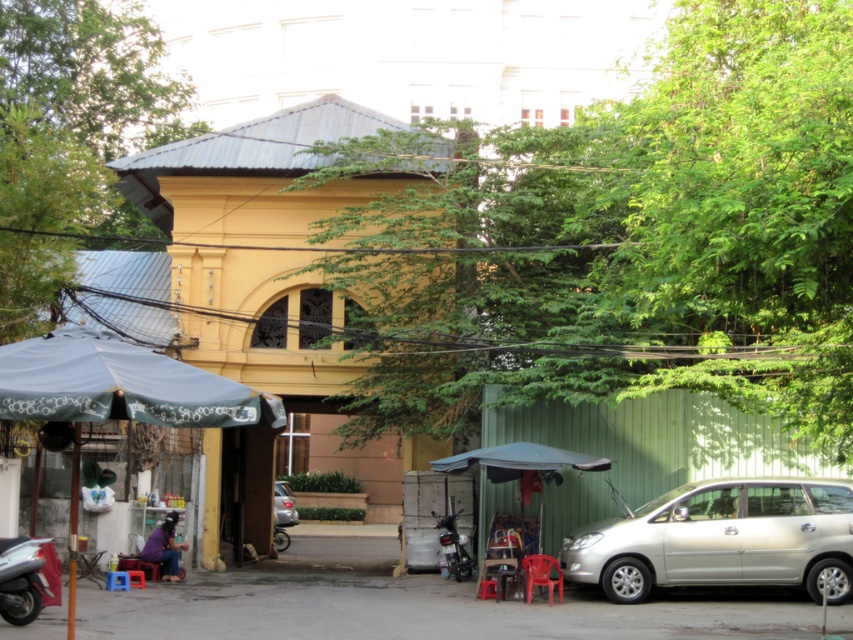
Does silver metallic car at lower right have a lesser height compared to shiny black motorcycle at center?

Incorrect, silver metallic car at lower right's height does not fall short of shiny black motorcycle at center's.

Which is below, silver metallic car at lower right or shiny black motorcycle at center?

shiny black motorcycle at center is below.

Between point (793, 509) and point (457, 544), which one is positioned in front?

Point (793, 509) is more forward.

The image size is (853, 640). Find the location of `silver metallic car at lower right`. silver metallic car at lower right is located at coordinates (722, 538).

Does blue fabric umbrella at lower left have a greater width compared to metallic silver motorcycle at lower left?

Indeed, blue fabric umbrella at lower left has a greater width compared to metallic silver motorcycle at lower left.

How distant is blue fabric umbrella at lower left from metallic silver motorcycle at lower left?

They are 11.91 feet apart.

Between point (94, 387) and point (30, 548), which one is positioned in front?

Positioned in front is point (94, 387).

Identify the location of blue fabric umbrella at lower left. (120, 385).

How far apart are green leafy tree at center and silver metallic car at lower right?

green leafy tree at center is 3.94 meters away from silver metallic car at lower right.

Which is more to the left, green leafy tree at center or silver metallic car at lower right?

green leafy tree at center is more to the left.

Find the location of a particular element. The image size is (853, 640). green leafy tree at center is located at coordinates (622, 240).